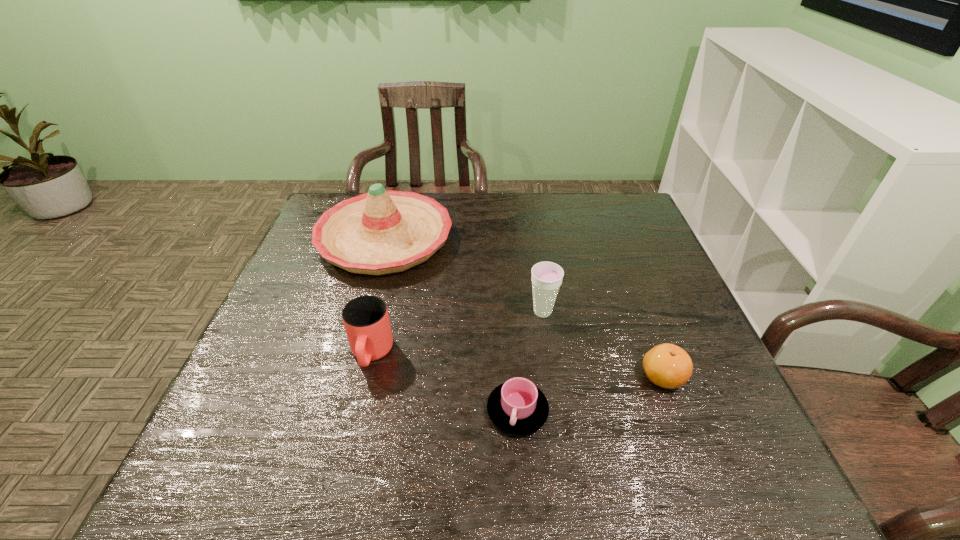
You are a GUI agent. You are given a task and a screenshot of the screen. Output one action in this format:
    pyautogui.click(x=<x>, y=<y>)
    Task: Click on the free spot between the tallest object and the shortest object
    This screenshot has height=540, width=960.
    Given the screenshot: What is the action you would take?
    coord(451,325)

Identify which object is located as the fourth nearest to the shortest object. Please provide its 2D coordinates. Your answer should be formatted as a tuple, i.e. [(x, y)], where the tuple contains the x and y coordinates of a point satisfying the conditions above.

[(380, 232)]

Where is `object that ranks as the closest to the clementine`? This screenshot has width=960, height=540. object that ranks as the closest to the clementine is located at coordinates (546, 277).

Select which cup appears as the closest to the fourth nearest object. Please provide its 2D coordinates. Your answer should be formatted as a tuple, i.e. [(x, y)], where the tuple contains the x and y coordinates of a point satisfying the conditions above.

[(518, 407)]

Where is `cup that is the second closest to the second farthest cup`? cup that is the second closest to the second farthest cup is located at coordinates (546, 277).

Where is `vacant space that satisfies the following two spatial constraints: 1. on the front side of the tallest object; 2. on the right side of the fourth nearest object`? The width and height of the screenshot is (960, 540). vacant space that satisfies the following two spatial constraints: 1. on the front side of the tallest object; 2. on the right side of the fourth nearest object is located at coordinates (365, 312).

You are a GUI agent. You are given a task and a screenshot of the screen. Output one action in this format:
    pyautogui.click(x=<x>, y=<y>)
    Task: Click on the free space that satisfies the following two spatial constraints: 1. on the handle side of the leftmost cup; 2. on the left side of the fourth tallest object
    Image resolution: width=960 pixels, height=540 pixels.
    Given the screenshot: What is the action you would take?
    pyautogui.click(x=366, y=376)